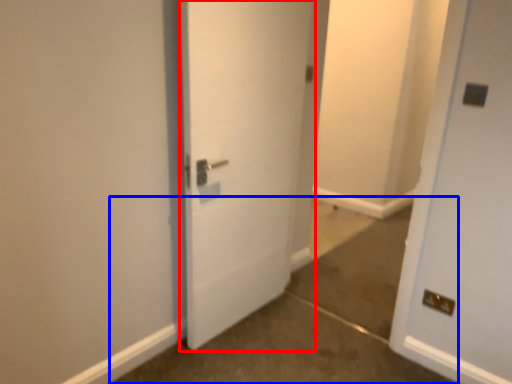
Question: Which point is further to the camera, door (highlighted by a red box) or concrete (highlighted by a blue box)?

Choices:
 (A) door
 (B) concrete

Answer: (A)